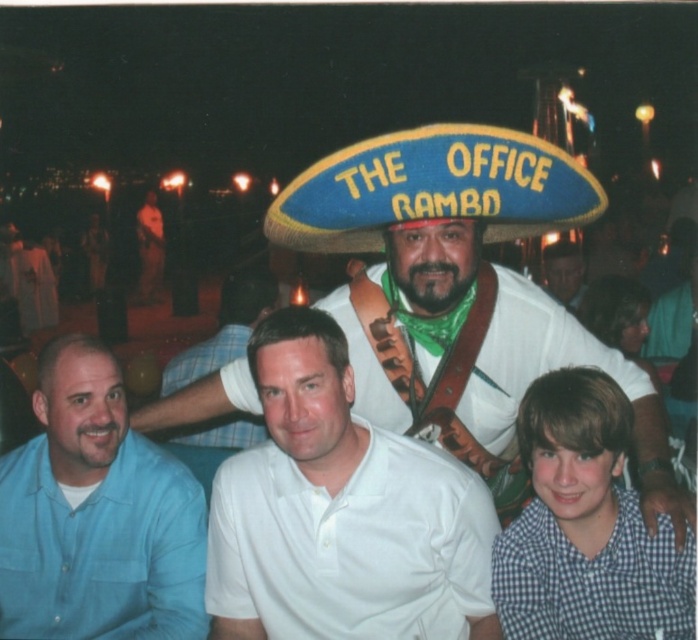
Question: Is white fabric shirt at center thinner than checkered fabric shirt at lower right?

Choices:
 (A) yes
 (B) no

Answer: (B)

Question: Is checkered fabric shirt at lower right smaller than blue felt sombrero at center?

Choices:
 (A) yes
 (B) no

Answer: (A)

Question: Which point is closer to the camera?

Choices:
 (A) blue felt sombrero at center
 (B) checkered fabric shirt at lower right
 (C) blue cotton shirt at left
 (D) white fabric shirt at center

Answer: (B)

Question: Does blue cotton shirt at left have a greater width compared to blue felt sombrero at center?

Choices:
 (A) yes
 (B) no

Answer: (B)

Question: Which object appears closest to the camera in this image?

Choices:
 (A) matte white shirt at center
 (B) blue felt sombrero at center

Answer: (B)

Question: Estimate the real-world distances between objects in this image. Which object is closer to the white fabric shirt at center?

Choices:
 (A) white cotton polo shirt at center
 (B) blue cotton shirt at left
 (C) blue felt sombrero at center

Answer: (C)